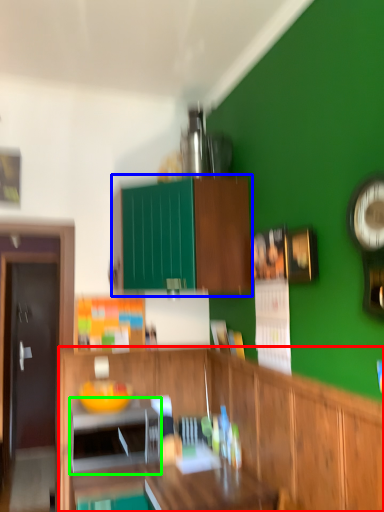
Question: Based on their relative distances, which object is nearer to cabinetry (highlighted by a red box)? Choose from cabinetry (highlighted by a blue box) and appliance (highlighted by a green box).

Choices:
 (A) cabinetry
 (B) appliance

Answer: (B)